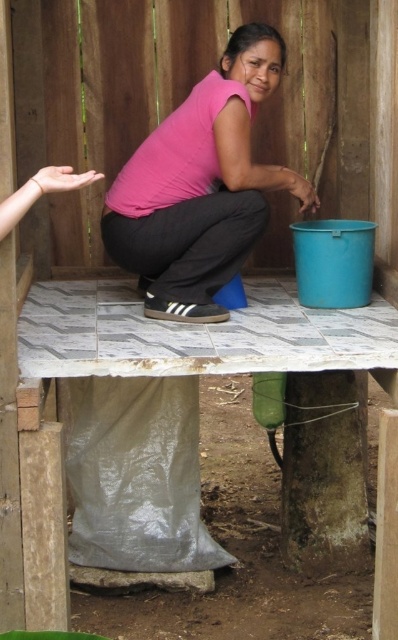
Question: Considering the relative positions of white tiled picnic table at center and pink matte shirt at center in the image provided, where is white tiled picnic table at center located with respect to pink matte shirt at center?

Choices:
 (A) above
 (B) below

Answer: (B)

Question: Which object is farther from the camera taking this photo?

Choices:
 (A) white tiled picnic table at center
 (B) pink matte shirt at center

Answer: (B)

Question: Can you confirm if white tiled picnic table at center is positioned above pink matte shirt at center?

Choices:
 (A) yes
 (B) no

Answer: (B)

Question: Is white tiled picnic table at center to the left of pink matte shirt at center from the viewer's perspective?

Choices:
 (A) no
 (B) yes

Answer: (B)